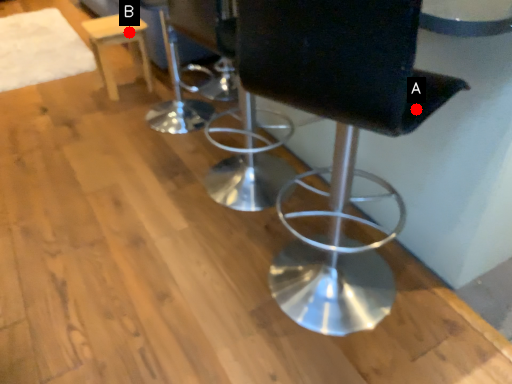
Question: Two points are circled on the image, labeled by A and B beside each circle. Which point is farther to the camera?

Choices:
 (A) A is further
 (B) B is further

Answer: (B)